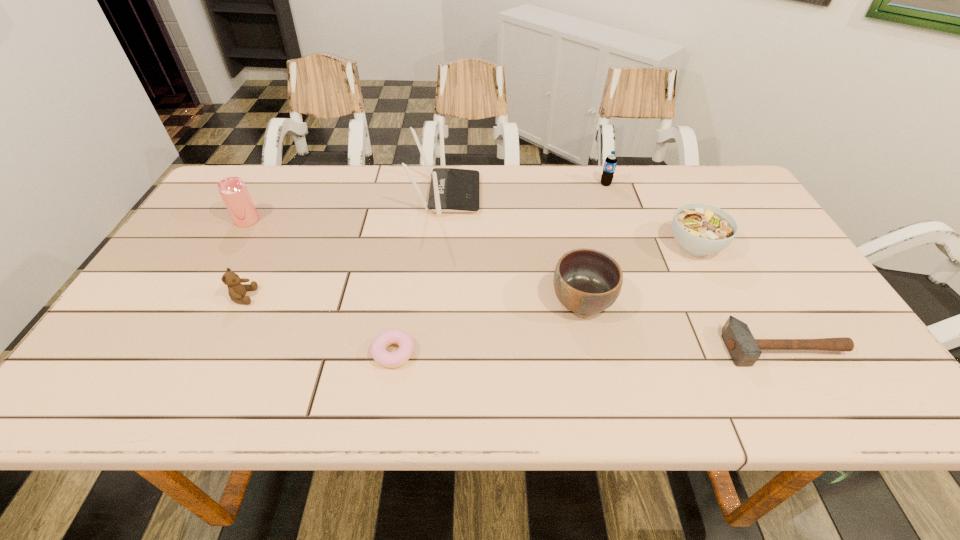
I want to click on vacant area in the image that satisfies the following two spatial constraints: 1. on the front-facing side of the router; 2. on the right side of the fourth object from right to left, so click(x=437, y=301).

The width and height of the screenshot is (960, 540). Find the location of `free space that satisfies the following two spatial constraints: 1. on the front-facing side of the router; 2. on the left side of the soup bowl`. free space that satisfies the following two spatial constraints: 1. on the front-facing side of the router; 2. on the left side of the soup bowl is located at coordinates [442, 246].

Identify the location of vacant space that satisfies the following two spatial constraints: 1. on the front-facing side of the bowl; 2. on the left side of the second object from left to right. The width and height of the screenshot is (960, 540). (241, 301).